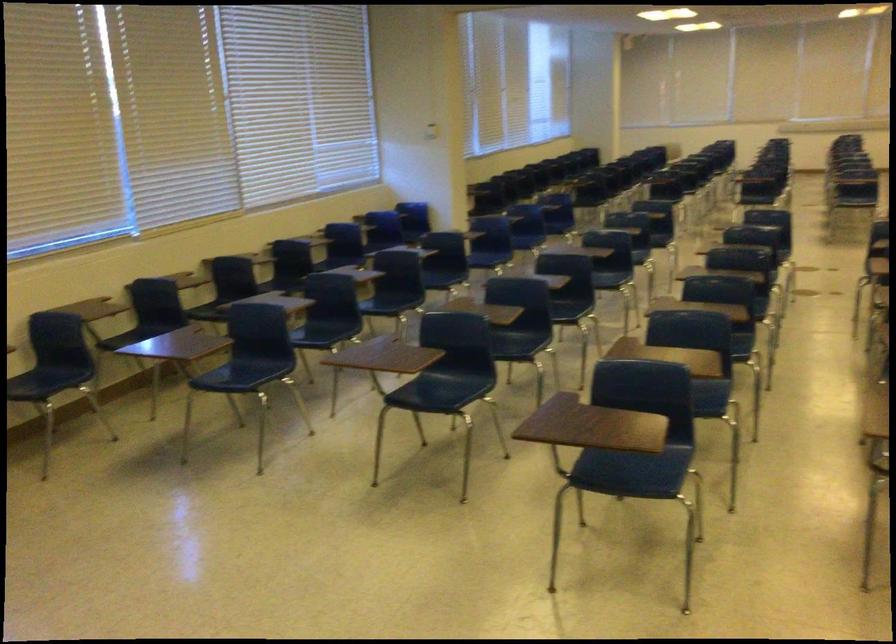
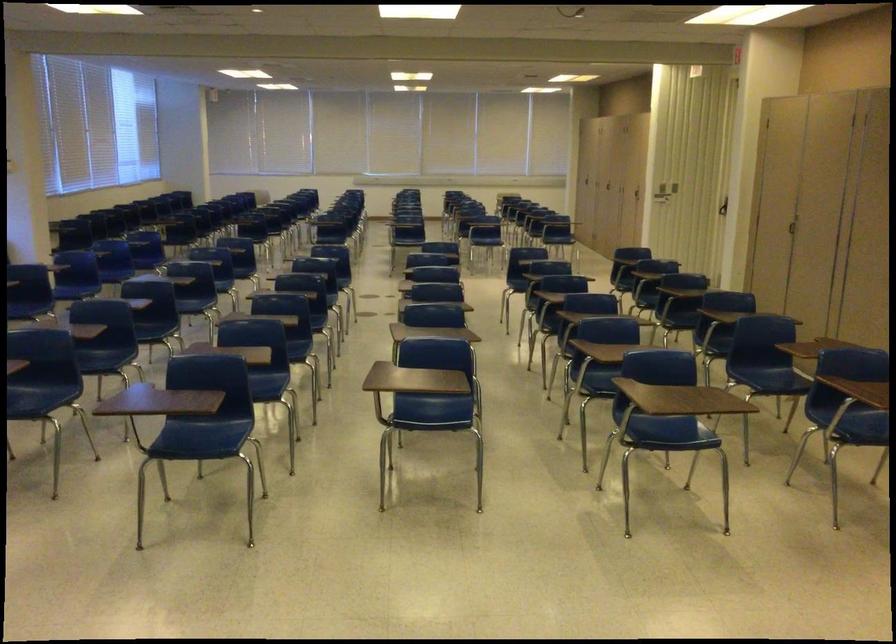
In the second image, find the point that corresponds to pixel 634 460 in the first image.

(203, 436)